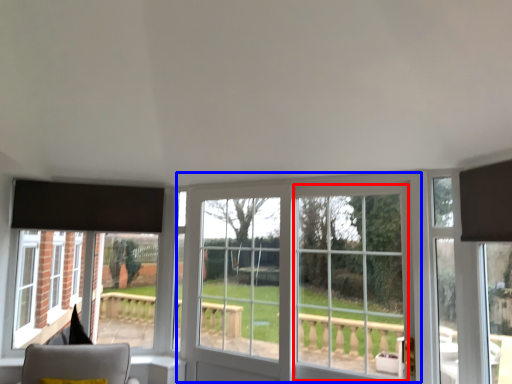
Question: Which point is further to the camera, glass door (highlighted by a red box) or window (highlighted by a blue box)?

Choices:
 (A) glass door
 (B) window

Answer: (B)